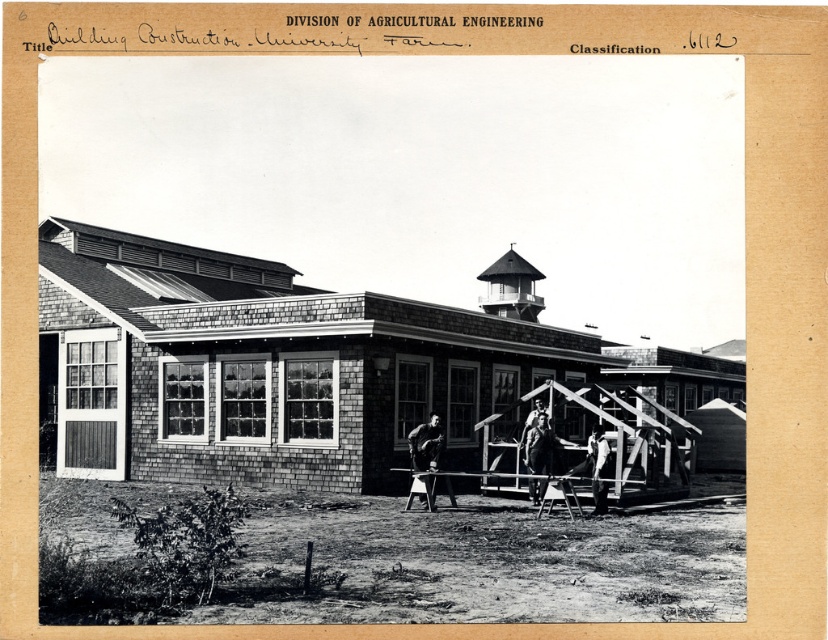
Based on the photo, you are an inspector checking the construction site at the University Farm. You see both the wooden ladder at center and the metallic silver ladder at center. Which ladder is closer to you?

The wooden ladder at center is closer to you because the metallic silver ladder at center is behind it.

You are an architect examining this historical construction site photo. You notice a point marked at coordinates (538,445). What object is located exactly at that point?

The point at coordinates (538,445) is occupied by a smooth wooden frame at center.

You are a construction worker at the university farm. You need to place a 2.5 meter long wooden beam between the smooth wooden frame at center and the wooden ladder at center. Is there enough space to place the beam horizontally between them?

The smooth wooden frame at center is 2.35 meters away from the wooden ladder at center. Since the beam is 2.5 meters long, which is longer than the distance between them, the beam cannot be placed horizontally between the smooth wooden frame at center and the wooden ladder at center.